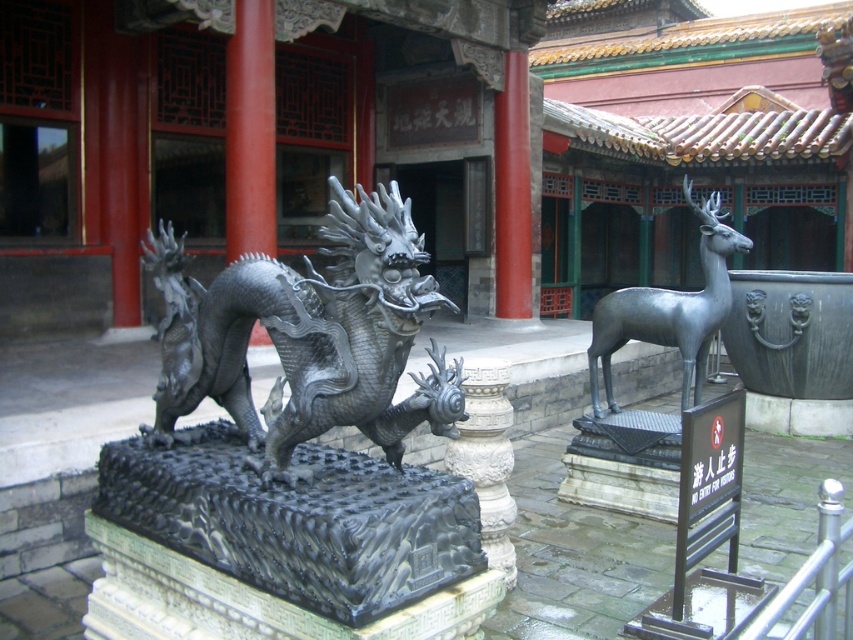
Question: Does polished silver dragon at center come behind polished silver deer at center right?

Choices:
 (A) no
 (B) yes

Answer: (A)

Question: Among these points, which one is farthest from the camera?

Choices:
 (A) (724, 310)
 (B) (498, 560)
 (C) (419, 388)

Answer: (A)

Question: Can you confirm if polished silver deer at center right is positioned above white stone pillar at center?

Choices:
 (A) no
 (B) yes

Answer: (B)

Question: Is polished silver dragon at center behind polished silver deer at center right?

Choices:
 (A) yes
 (B) no

Answer: (B)

Question: Which of these objects is positioned farthest from the polished silver dragon at center?

Choices:
 (A) polished silver deer at center right
 (B) white stone pillar at center

Answer: (A)

Question: Which of the following is the farthest from the observer?

Choices:
 (A) white stone pillar at center
 (B) polished silver dragon at center

Answer: (A)